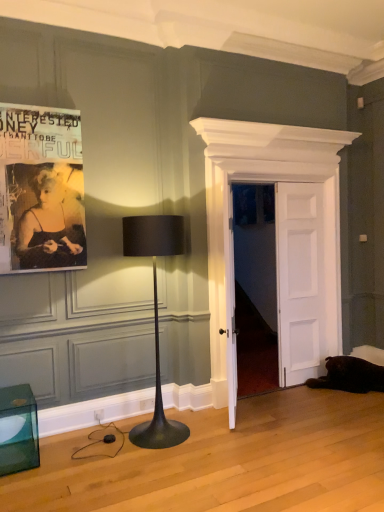
The image size is (384, 512). Find the location of `free point above black paper poster at upper left (from a real-world perspective)`. free point above black paper poster at upper left (from a real-world perspective) is located at coordinates (31, 104).